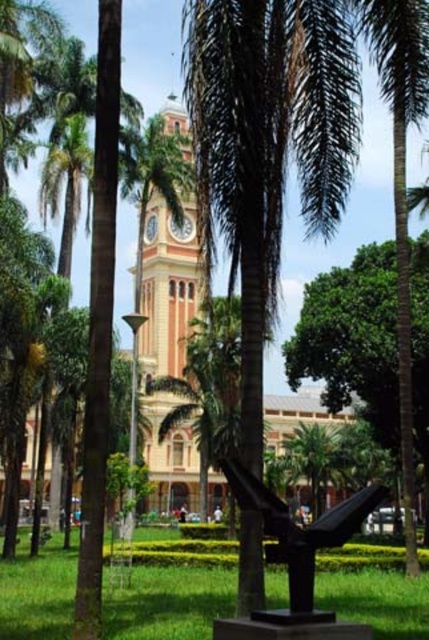
Question: In this image, where is green grass at center located relative to black polished sculpture at center?

Choices:
 (A) left
 (B) right

Answer: (A)

Question: Where is green grass at center located in relation to yellow brick clock tower at center in the image?

Choices:
 (A) below
 (B) above

Answer: (A)

Question: Estimate the real-world distances between objects in this image. Which object is closer to the yellow brick clock tower at center?

Choices:
 (A) green grass at center
 (B) black polished sculpture at center

Answer: (A)

Question: Observing the image, what is the correct spatial positioning of green grass at center in reference to black polished sculpture at center?

Choices:
 (A) left
 (B) right

Answer: (A)

Question: Which of the following is the farthest from the observer?

Choices:
 (A) (217, 605)
 (B) (162, 369)

Answer: (B)

Question: Based on their relative distances, which object is farther from the black polished sculpture at center?

Choices:
 (A) yellow brick clock tower at center
 (B) green grass at center

Answer: (A)